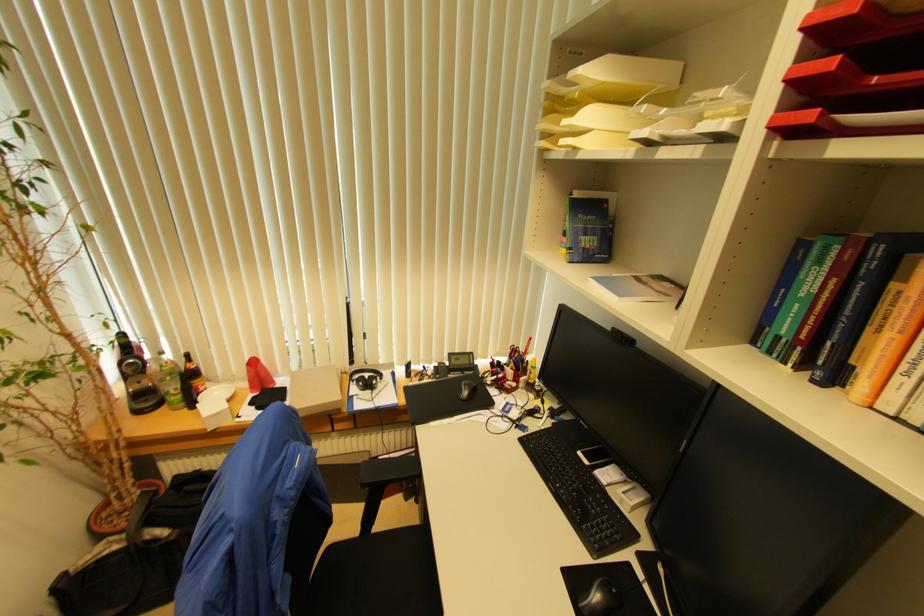
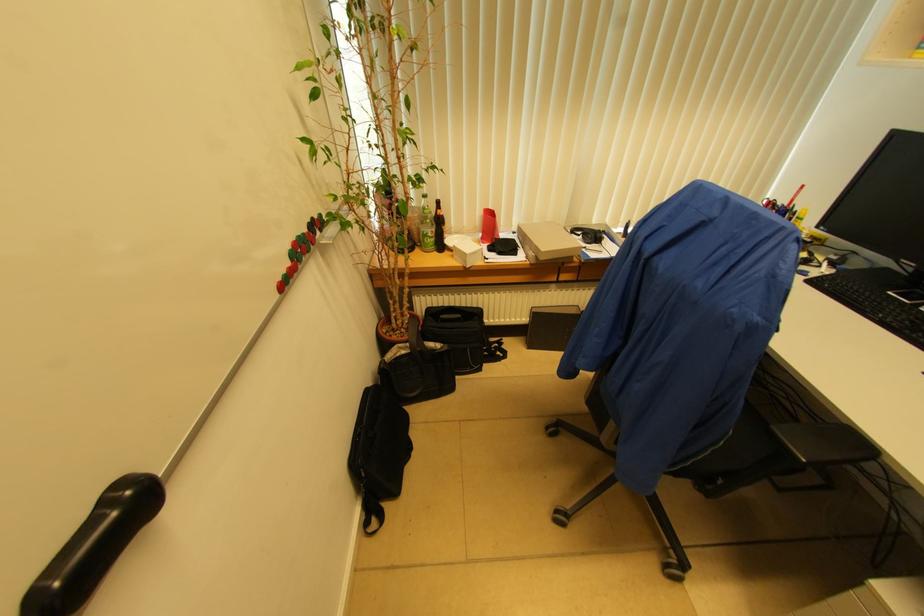
Question: The images are taken continuously from a first-person perspective. In which direction is your viewpoint rotating?

Choices:
 (A) Left
 (B) Right
 (C) Up
 (D) Down

Answer: (D)